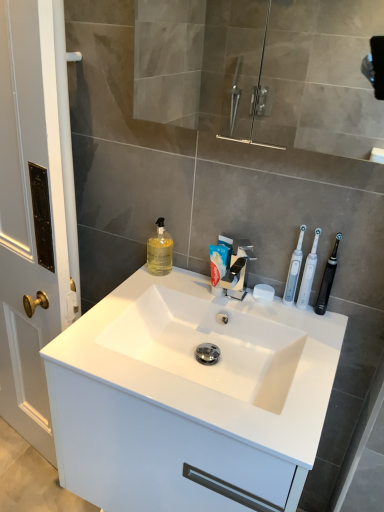
In order to click on free point to the right of translucent yellow liquid at sink left in this screenshot , I will do (x=193, y=281).